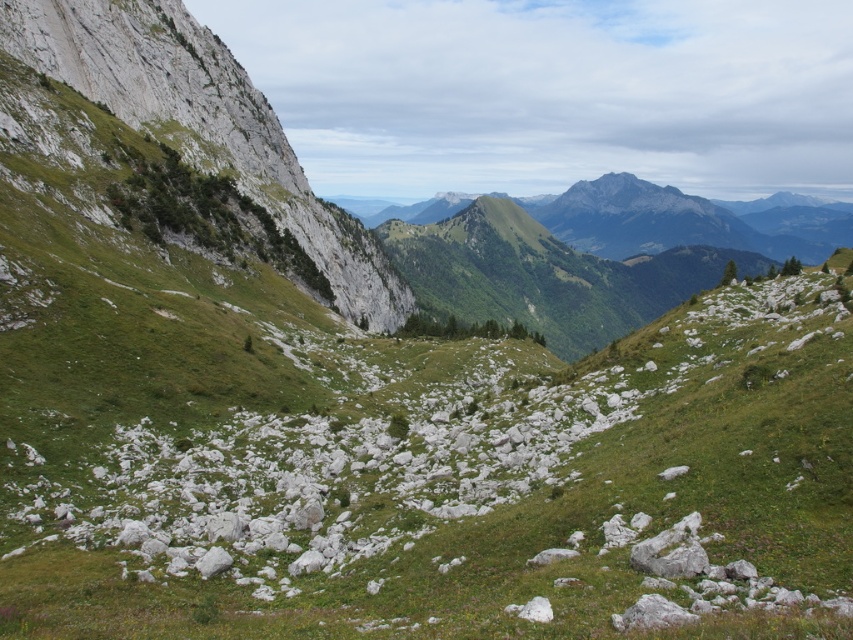
Which is behind, point (750, 410) or point (346, 268)?

Positioned behind is point (346, 268).

Is green grassy at center wider than green grassy slope at left?

Indeed, green grassy at center has a greater width compared to green grassy slope at left.

Between point (322, 534) and point (341, 301), which one is positioned in front?

Positioned in front is point (322, 534).

This screenshot has width=853, height=640. What are the coordinates of `green grassy at center` in the screenshot? It's located at (450, 484).